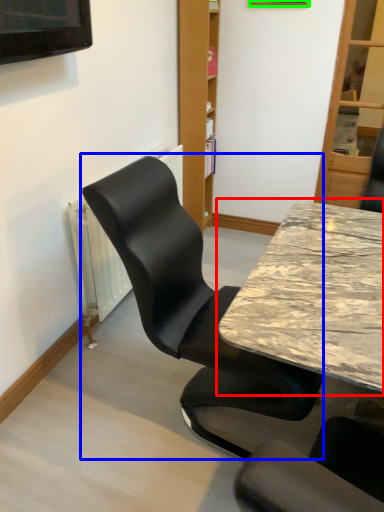
Question: Which object is positioned farthest from table (highlighted by a red box)? Select from chair (highlighted by a blue box) and picture frame (highlighted by a green box).

Choices:
 (A) chair
 (B) picture frame

Answer: (B)